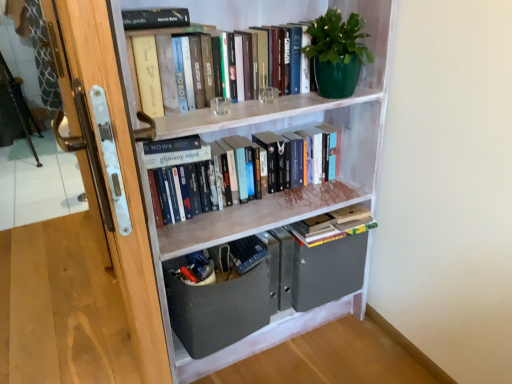
I want to click on wooden book at center, the third book viewed from the top, so click(x=333, y=225).

What is the approximate height of matte gray drawer at lower center?

The height of matte gray drawer at lower center is 12.59 inches.

What do you see at coordinates (109, 164) in the screenshot?
I see `wooden door handle at left` at bounding box center [109, 164].

The image size is (512, 384). In order to click on hardcover books at upper center, arranged as the 3th book when ordered from the bottom in this screenshot , I will do `click(155, 35)`.

The height and width of the screenshot is (384, 512). What do you see at coordinates (285, 128) in the screenshot?
I see `white painted wood bookcase at upper center` at bounding box center [285, 128].

You are a GUI agent. You are given a task and a screenshot of the screen. Output one action in this format:
    pyautogui.click(x=<x>, y=<y>)
    Task: Click on the hardcover books at center, positioned as the 2th book in bottom-to-top order
    This screenshot has height=384, width=512.
    Given the screenshot: What is the action you would take?
    pyautogui.click(x=225, y=175)

Looking at this image, does wooden book at center, acting as the first book starting from the bottom, come behind hardcover books at center, positioned as the 2th book in bottom-to-top order?

Yes, it is.

Which of these two, wooden book at center, acting as the first book starting from the bottom, or hardcover books at center, positioned as the 2th book in bottom-to-top order, is bigger?

With larger size is hardcover books at center, positioned as the 2th book in bottom-to-top order.

Is wooden book at center, the third book viewed from the top, at the left side of hardcover books at center, placed as the 2th book when sorted from top to bottom?

No.

Is wooden book at center, the third book viewed from the top, turned away from hardcover books at center, placed as the 2th book when sorted from top to bottom?

wooden book at center, the third book viewed from the top, is not turned away from hardcover books at center, placed as the 2th book when sorted from top to bottom.

From a real-world perspective, is hardcover books at upper center, arranged as the 3th book when ordered from the bottom, physically located above or below hardcover books at center, positioned as the 2th book in bottom-to-top order?

hardcover books at upper center, arranged as the 3th book when ordered from the bottom, is above hardcover books at center, positioned as the 2th book in bottom-to-top order.

Could you tell me if hardcover books at upper center, arranged as the 3th book when ordered from the bottom, is facing hardcover books at center, positioned as the 2th book in bottom-to-top order?

No, hardcover books at upper center, arranged as the 3th book when ordered from the bottom, does not turn towards hardcover books at center, positioned as the 2th book in bottom-to-top order.

Would you say hardcover books at upper center, arranged as the 3th book when ordered from the bottom, is outside hardcover books at center, positioned as the 2th book in bottom-to-top order?

Yes, hardcover books at upper center, arranged as the 3th book when ordered from the bottom, is outside of hardcover books at center, positioned as the 2th book in bottom-to-top order.

Does hardcover books at upper center, which is the first book from top to bottom, have a lesser width compared to matte gray drawer at lower center?

Indeed, hardcover books at upper center, which is the first book from top to bottom, has a lesser width compared to matte gray drawer at lower center.

From a real-world perspective, which is physically above, hardcover books at upper center, arranged as the 3th book when ordered from the bottom, or matte gray drawer at lower center?

hardcover books at upper center, arranged as the 3th book when ordered from the bottom.

Which is in front, hardcover books at upper center, arranged as the 3th book when ordered from the bottom, or matte gray drawer at lower center?

hardcover books at upper center, arranged as the 3th book when ordered from the bottom, is in front.

Who is shorter, hardcover books at upper center, arranged as the 3th book when ordered from the bottom, or matte gray drawer at lower center?

hardcover books at upper center, arranged as the 3th book when ordered from the bottom.

In the image, is white painted wood bookcase at upper center positioned in front of or behind green matte pot at upper right?

In the image, white painted wood bookcase at upper center appears in front of green matte pot at upper right.

Based on their positions, is white painted wood bookcase at upper center located to the left or right of green matte pot at upper right?

white painted wood bookcase at upper center is positioned on green matte pot at upper right's left side.

Does white painted wood bookcase at upper center contain green matte pot at upper right?

Yes, green matte pot at upper right is a part of white painted wood bookcase at upper center.

Can you tell me how much white painted wood bookcase at upper center and green matte pot at upper right differ in facing direction?

white painted wood bookcase at upper center and green matte pot at upper right are facing 0.000102 degrees away from each other.

From the image's perspective, is green matte pot at upper right above or below matte gray drawer at lower center?

Based on their image positions, green matte pot at upper right is located above matte gray drawer at lower center.

What's the angular difference between green matte pot at upper right and matte gray drawer at lower center's facing directions?

green matte pot at upper right and matte gray drawer at lower center are facing 2.4 degrees away from each other.

Based on the photo, how distant is green matte pot at upper right from matte gray drawer at lower center?

30.37 inches.

Is green matte pot at upper right located outside matte gray drawer at lower center?

green matte pot at upper right lies outside matte gray drawer at lower center's area.

From the image's perspective, is hardcover books at upper center, which is the first book from top to bottom, on white painted wood bookcase at upper center?

Yes, from the image's perspective, hardcover books at upper center, which is the first book from top to bottom, is above white painted wood bookcase at upper center.

Is hardcover books at upper center, arranged as the 3th book when ordered from the bottom, facing away from white painted wood bookcase at upper center?

That's right, hardcover books at upper center, arranged as the 3th book when ordered from the bottom, is facing away from white painted wood bookcase at upper center.

Is there a large distance between hardcover books at upper center, which is the first book from top to bottom, and white painted wood bookcase at upper center?

No, hardcover books at upper center, which is the first book from top to bottom, is not far away from white painted wood bookcase at upper center.

Considering the sizes of hardcover books at upper center, arranged as the 3th book when ordered from the bottom, and white painted wood bookcase at upper center in the image, is hardcover books at upper center, arranged as the 3th book when ordered from the bottom, taller or shorter than white painted wood bookcase at upper center?

In the image, hardcover books at upper center, arranged as the 3th book when ordered from the bottom, appears to be shorter than white painted wood bookcase at upper center.

Is hardcover books at center, positioned as the 2th book in bottom-to-top order, inside or outside of hardcover books at upper center, arranged as the 3th book when ordered from the bottom?

The correct answer is: outside.

In the image, is hardcover books at center, placed as the 2th book when sorted from top to bottom, positioned in front of or behind hardcover books at upper center, which is the first book from top to bottom?

Visually, hardcover books at center, placed as the 2th book when sorted from top to bottom, is located behind hardcover books at upper center, which is the first book from top to bottom.

The image size is (512, 384). I want to click on the 1st book counting from the right side of the hardcover books at upper center, which is the first book from top to bottom, so click(225, 175).

Can you confirm if hardcover books at center, positioned as the 2th book in bottom-to-top order, is smaller than hardcover books at upper center, which is the first book from top to bottom?

No.

From the image's perspective, which book is the 1st one above the wooden book at center, acting as the first book starting from the bottom? Please provide its 2D coordinates.

[(225, 175)]

Identify the location of book that is above the hardcover books at center, placed as the 2th book when sorted from top to bottom (from a real-world perspective). (155, 35).

Estimate the real-world distances between objects in this image. Which object is further from matte gray drawer at lower center, green matte pot at upper right or wooden door handle at left?

Based on the image, green matte pot at upper right appears to be further to matte gray drawer at lower center.

Estimate the real-world distances between objects in this image. Which object is further from wooden book at center, the third book viewed from the top, white painted wood bookcase at upper center or hardcover books at center, positioned as the 2th book in bottom-to-top order?

hardcover books at center, positioned as the 2th book in bottom-to-top order, lies further to wooden book at center, the third book viewed from the top, than the other object.

Based on their spatial positions, is hardcover books at upper center, which is the first book from top to bottom, or matte gray drawer at lower center further from white painted wood bookcase at upper center?

The object further to white painted wood bookcase at upper center is matte gray drawer at lower center.

Considering their positions, is white painted wood bookcase at upper center positioned further to hardcover books at center, placed as the 2th book when sorted from top to bottom, than wooden door handle at left?

wooden door handle at left is further to hardcover books at center, placed as the 2th book when sorted from top to bottom.

Estimate the real-world distances between objects in this image. Which object is closer to white painted wood bookcase at upper center, hardcover books at center, placed as the 2th book when sorted from top to bottom, or matte gray drawer at lower center?

hardcover books at center, placed as the 2th book when sorted from top to bottom, lies closer to white painted wood bookcase at upper center than the other object.

Which object lies nearer to the anchor point wooden book at center, acting as the first book starting from the bottom, matte gray drawer at lower center or white painted wood bookcase at upper center?

white painted wood bookcase at upper center is positioned closer to the anchor wooden book at center, acting as the first book starting from the bottom.

Based on the photo, considering their positions, is wooden book at center, acting as the first book starting from the bottom, positioned further to white painted wood bookcase at upper center than hardcover books at center, positioned as the 2th book in bottom-to-top order?

wooden book at center, acting as the first book starting from the bottom, lies further to white painted wood bookcase at upper center than the other object.

Looking at the image, which one is located closer to matte gray drawer at lower center, wooden door handle at left or green matte pot at upper right?

wooden door handle at left is closer to matte gray drawer at lower center.

The height and width of the screenshot is (384, 512). In order to click on bookcase between hardcover books at upper center, which is the first book from top to bottom, and wooden book at center, the third book viewed from the top, vertically in this screenshot , I will do `click(285, 128)`.

The width and height of the screenshot is (512, 384). I want to click on bookcase that lies between green matte pot at upper right and wooden book at center, acting as the first book starting from the bottom, from top to bottom, so click(285, 128).

This screenshot has width=512, height=384. Identify the location of book between green matte pot at upper right and hardcover books at center, positioned as the 2th book in bottom-to-top order, in the vertical direction. (155, 35).

Find the location of a particular element. This screenshot has width=512, height=384. bookcase between hardcover books at upper center, arranged as the 3th book when ordered from the bottom, and matte gray drawer at lower center in the up-down direction is located at coordinates (285, 128).